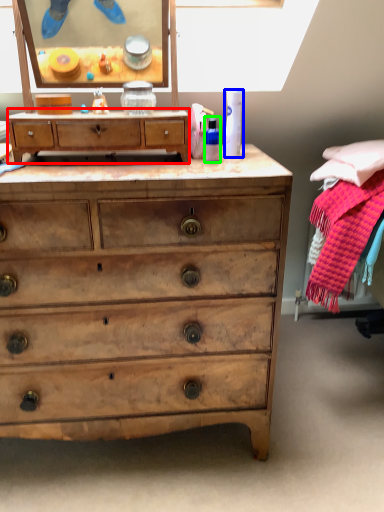
Question: Estimate the real-world distances between objects in this image. Which object is farther from chest of drawers (highlighted by a red box), toiletry (highlighted by a blue box) or toiletry (highlighted by a green box)?

Choices:
 (A) toiletry
 (B) toiletry

Answer: (A)